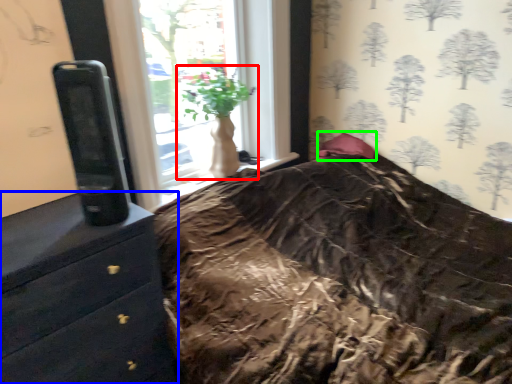
Question: Which object is the farthest from houseplant (highlighted by a red box)? Choose among these: chest of drawers (highlighted by a blue box) or pillow (highlighted by a green box).

Choices:
 (A) chest of drawers
 (B) pillow

Answer: (A)